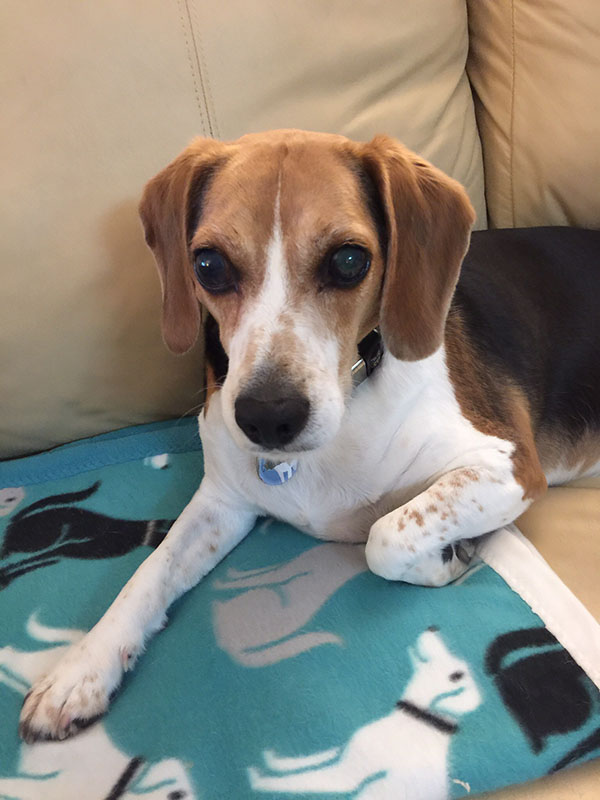
Image resolution: width=600 pixels, height=800 pixels. In order to click on bottom cushion surface in this screenshot , I will do `click(572, 542)`.